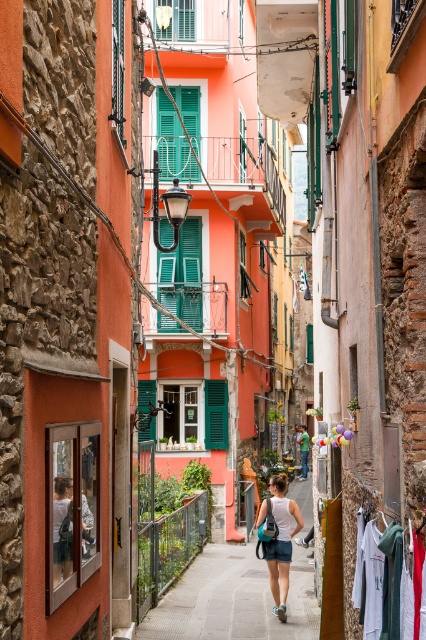
You are a traveler walking through the narrow alleyway and notice two white items. One is a white cotton shirt at lower right and the other is a white fabric at center. Which item is larger in size?

The white cotton shirt at lower right is bigger than the white fabric at center.

Consider the image. You are a traveler standing in the Mediterranean alleyway. You see a white cotton shirt at lower right. Where exactly is the white cotton shirt located in the alleyway?

The white cotton shirt at lower right is located at point (383, 582) in the alleyway.

You are a traveler walking through the narrow alleyway and notice a white cotton shirt at lower right and a green painted wood shutter at center. Which object is closer to the ground?

The white cotton shirt at lower right is closer to the ground because it is shorter than the green painted wood shutter at center.